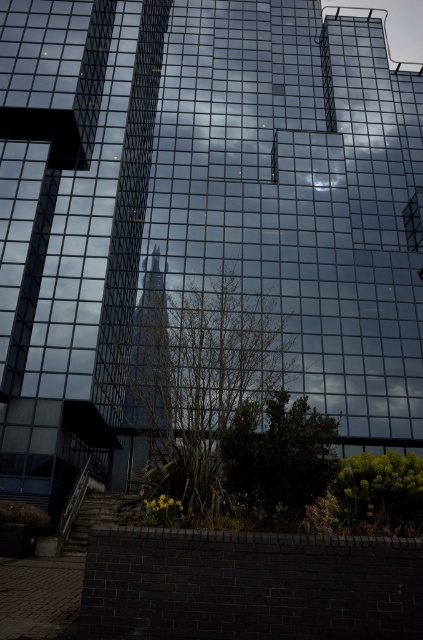
Question: Based on their relative distances, which object is farther from the green leafy tree at lower center?

Choices:
 (A) green leafy tree at center
 (B) green leafy bush at lower right

Answer: (A)

Question: Among these points, which one is farthest from the camera?

Choices:
 (A) (154, 332)
 (B) (359, 496)
 (C) (304, 476)

Answer: (A)

Question: Observing the image, what is the correct spatial positioning of green leafy tree at lower center in reference to green leafy bush at lower right?

Choices:
 (A) left
 (B) right

Answer: (A)

Question: Is green leafy tree at center thinner than green leafy tree at lower center?

Choices:
 (A) no
 (B) yes

Answer: (A)

Question: Which point is closer to the camera?

Choices:
 (A) (412, 476)
 (B) (192, 381)

Answer: (A)

Question: Does green leafy tree at center appear over green leafy tree at lower center?

Choices:
 (A) no
 (B) yes

Answer: (A)